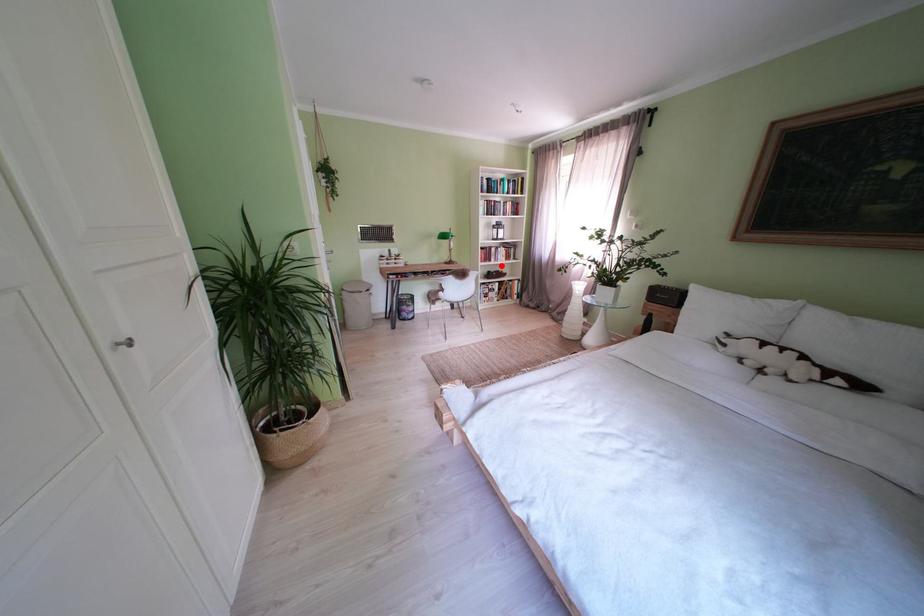
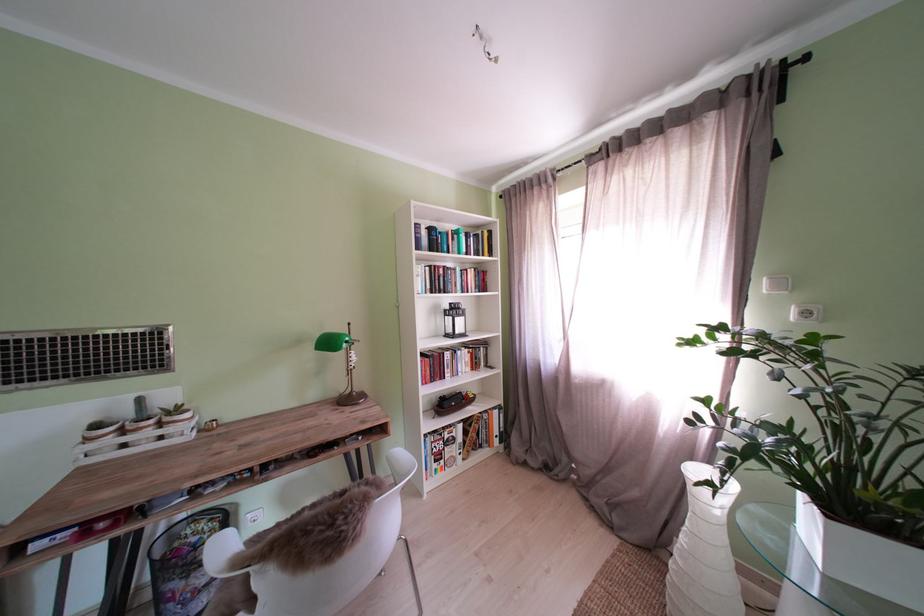
Question: I am providing you with two images of the same scene from different viewpoints. A red point is shown in image1. For the corresponding object point in image2, is it positioned nearer or farther from the camera?

Choices:
 (A) Nearer
 (B) Farther

Answer: (B)